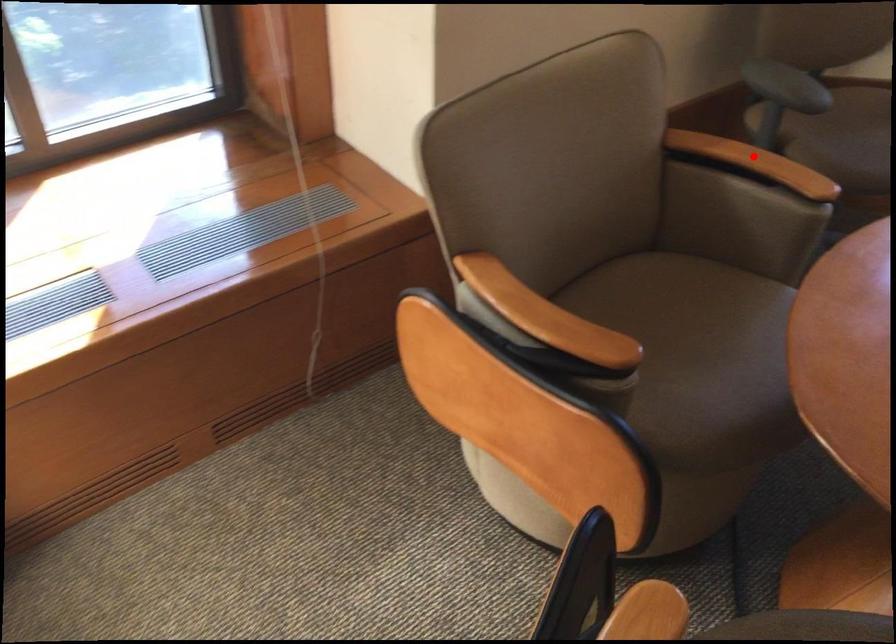
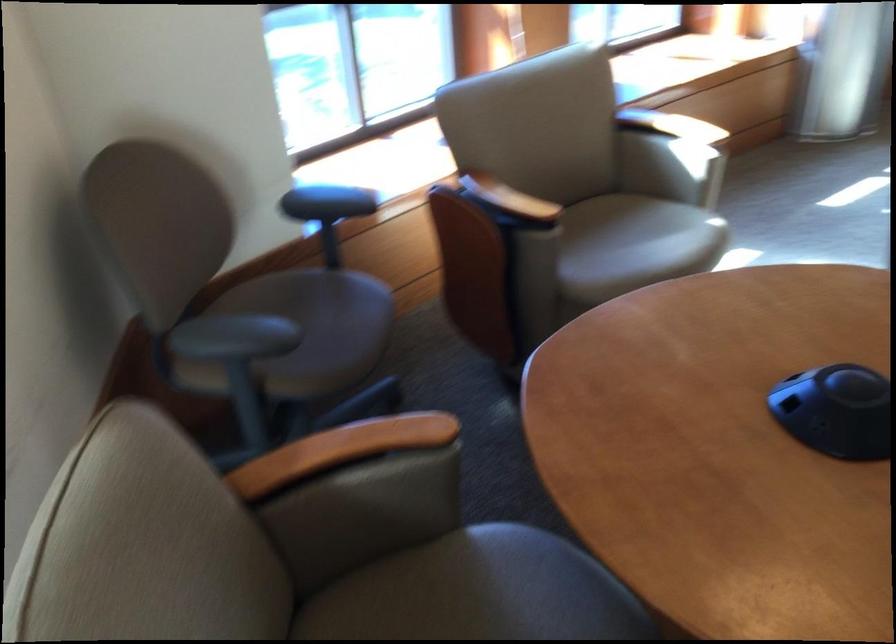
Question: A red point is marked in image1. In image2, is the corresponding 3D point closer to the camera or farther? Reply with the corresponding letter.

Choices:
 (A) The corresponding 3D point is closer.
 (B) The corresponding 3D point is farther.

Answer: (A)